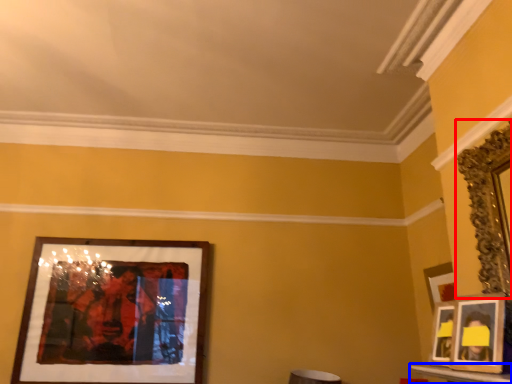
Question: Which object appears farthest to the camera in this image, picture frame (highlighted by a red box) or table (highlighted by a blue box)?

Choices:
 (A) picture frame
 (B) table

Answer: (A)